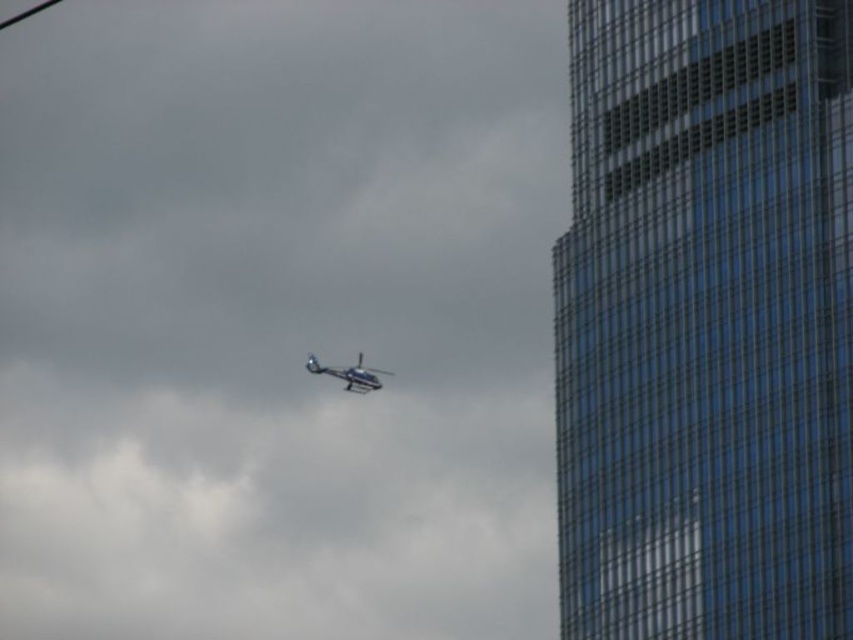
Question: Does transparent glass tower at right appear under metallic silver helicopter at center?

Choices:
 (A) yes
 (B) no

Answer: (B)

Question: Does transparent glass tower at right lie behind metallic silver helicopter at center?

Choices:
 (A) no
 (B) yes

Answer: (A)

Question: Which of the following is the closest to the observer?

Choices:
 (A) (602, 164)
 (B) (306, 356)

Answer: (A)

Question: Observing the image, what is the correct spatial positioning of transparent glass tower at right in reference to metallic silver helicopter at center?

Choices:
 (A) right
 (B) left

Answer: (A)

Question: Among these objects, which one is nearest to the camera?

Choices:
 (A) metallic silver helicopter at center
 (B) transparent glass tower at right

Answer: (B)

Question: Among these objects, which one is farthest from the camera?

Choices:
 (A) transparent glass tower at right
 (B) metallic silver helicopter at center

Answer: (B)